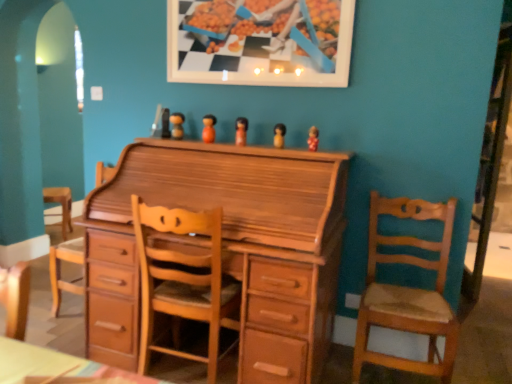
Question: Considering the relative sizes of light brown wooden chair at right, marked as the first chair in a right-to-left arrangement, and matte wooden figurine at center, marked as the 1th toy in a right-to-left arrangement, in the image provided, is light brown wooden chair at right, marked as the first chair in a right-to-left arrangement, bigger than matte wooden figurine at center, marked as the 1th toy in a right-to-left arrangement,?

Choices:
 (A) yes
 (B) no

Answer: (A)

Question: Is light brown wooden chair at right, the second chair viewed from the left, completely or partially outside of matte wooden figurine at center, which is the fifth toy from left to right?

Choices:
 (A) yes
 (B) no

Answer: (A)

Question: From the image's perspective, is light brown wooden chair at right, the second chair viewed from the left, below matte wooden figurine at center, marked as the 1th toy in a right-to-left arrangement?

Choices:
 (A) no
 (B) yes

Answer: (B)

Question: From the image's perspective, is light brown wooden chair at right, the second chair viewed from the left, on top of matte wooden figurine at center, marked as the 1th toy in a right-to-left arrangement?

Choices:
 (A) no
 (B) yes

Answer: (A)

Question: Does light brown wooden chair at right, the second chair viewed from the left, have a greater height compared to matte wooden figurine at center, marked as the 1th toy in a right-to-left arrangement?

Choices:
 (A) no
 (B) yes

Answer: (B)

Question: Based on their sizes in the image, would you say light brown wood swivel chair at center is bigger or smaller than matte wooden figurine at center, which is the fifth toy from left to right?

Choices:
 (A) big
 (B) small

Answer: (A)

Question: In terms of height, does light brown wood swivel chair at center look taller or shorter compared to matte wooden figurine at center, which is the fifth toy from left to right?

Choices:
 (A) short
 (B) tall

Answer: (B)

Question: Considering the positions of light brown wood swivel chair at center and matte wooden figurine at center, which is the fifth toy from left to right, in the image, is light brown wood swivel chair at center wider or thinner than matte wooden figurine at center, which is the fifth toy from left to right,?

Choices:
 (A) wide
 (B) thin

Answer: (A)

Question: Is light brown wood swivel chair at center to the left or to the right of matte wooden figurine at center, marked as the 1th toy in a right-to-left arrangement, in the image?

Choices:
 (A) right
 (B) left

Answer: (B)

Question: Would you say matte wooden figurine at center, marked as the 1th toy in a right-to-left arrangement, is inside or outside brown wooden figurine at center, which is the second toy in right-to-left order?

Choices:
 (A) outside
 (B) inside

Answer: (A)

Question: From a real-world perspective, relative to brown wooden figurine at center, which ranks as the 4th toy in left-to-right order, is matte wooden figurine at center, marked as the 1th toy in a right-to-left arrangement, vertically above or below?

Choices:
 (A) below
 (B) above

Answer: (A)

Question: From the image's perspective, is matte wooden figurine at center, marked as the 1th toy in a right-to-left arrangement, above or below brown wooden figurine at center, which ranks as the 4th toy in left-to-right order?

Choices:
 (A) below
 (B) above

Answer: (A)

Question: In terms of height, does matte wooden figurine at center, marked as the 1th toy in a right-to-left arrangement, look taller or shorter compared to brown wooden figurine at center, which ranks as the 4th toy in left-to-right order?

Choices:
 (A) tall
 (B) short

Answer: (A)

Question: Choose the correct answer: Is light brown wood swivel chair at center inside wooden figurine at center, marked as the third toy in a left-to-right arrangement, or outside it?

Choices:
 (A) inside
 (B) outside

Answer: (B)

Question: Is light brown wood swivel chair at center wider or thinner than wooden figurine at center, marked as the 3th toy in a right-to-left arrangement?

Choices:
 (A) wide
 (B) thin

Answer: (A)